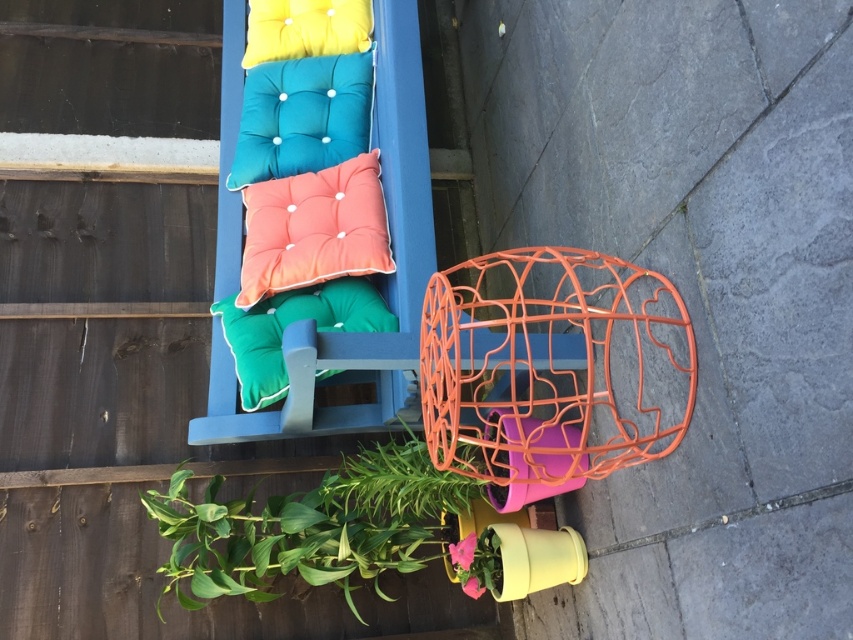
Question: Is green leafy plant at lower left thinner than green fabric pillow at center?

Choices:
 (A) no
 (B) yes

Answer: (A)

Question: Based on their relative distances, which object is farther from the green leafy plant at lower left?

Choices:
 (A) green fabric pillow at center
 (B) coral fabric cushion at center

Answer: (B)

Question: Is green leafy plant at lower left smaller than coral fabric cushion at center?

Choices:
 (A) no
 (B) yes

Answer: (A)

Question: Which object appears closest to the camera in this image?

Choices:
 (A) green fabric pillow at center
 (B) coral fabric cushion at center
 (C) green leafy plant at lower left

Answer: (C)

Question: Does green leafy plant at lower left have a larger size compared to coral fabric cushion at center?

Choices:
 (A) yes
 (B) no

Answer: (A)

Question: Estimate the real-world distances between objects in this image. Which object is closer to the green fabric pillow at center?

Choices:
 (A) coral fabric cushion at center
 (B) green leafy plant at lower left

Answer: (A)